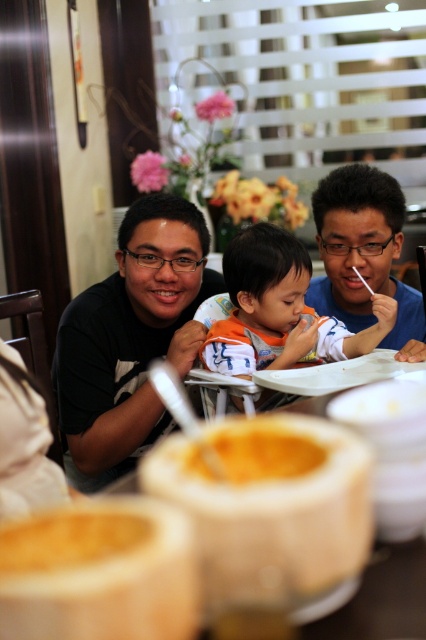
Question: Does orange cotton shirt at center have a greater width compared to white plastic table at center?

Choices:
 (A) no
 (B) yes

Answer: (B)

Question: Where is matte black shirt at upper right located in relation to white plastic table at center in the image?

Choices:
 (A) left
 (B) right

Answer: (B)

Question: Based on their relative distances, which object is farther from the orange cotton shirt at center?

Choices:
 (A) smooth beige bowl at center
 (B) yellow matte coconut at lower center
 (C) matte black shirt at upper right

Answer: (B)

Question: Considering the real-world distances, which object is farthest from the smooth beige bowl at center?

Choices:
 (A) yellow creamy soup at center
 (B) black matte shirt at center
 (C) matte black shirt at upper right
 (D) yellow matte coconut at lower center

Answer: (C)

Question: Which of the following is the closest to the observer?

Choices:
 (A) yellow matte coconut at lower center
 (B) smooth beige bowl at center
 (C) yellow creamy soup at center

Answer: (B)

Question: Is black matte shirt at center to the left of matte black shirt at upper right from the viewer's perspective?

Choices:
 (A) no
 (B) yes

Answer: (B)